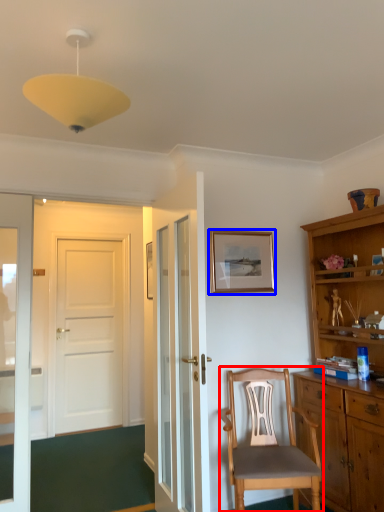
Question: Which object appears closest to the camera in this image, chair (highlighted by a red box) or picture frame (highlighted by a blue box)?

Choices:
 (A) chair
 (B) picture frame

Answer: (A)